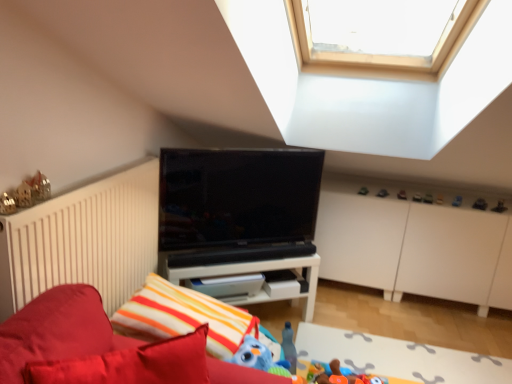
This screenshot has height=384, width=512. Find the location of `vacant space situated on the left part of green matte toy at upper right, the 11th toy in the front-to-back sequence`. vacant space situated on the left part of green matte toy at upper right, the 11th toy in the front-to-back sequence is located at coordinates (345, 187).